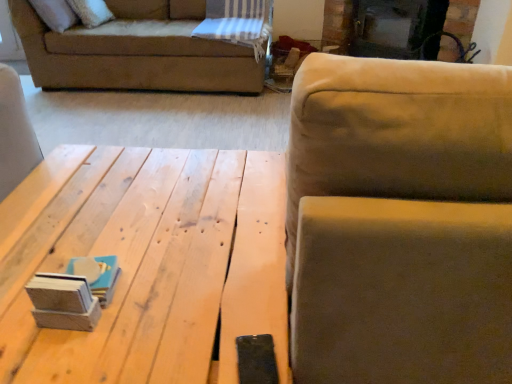
Question: Considering the relative sizes of suede-like beige couch at upper right and natural wood table at center in the image provided, is suede-like beige couch at upper right shorter than natural wood table at center?

Choices:
 (A) yes
 (B) no

Answer: (B)

Question: Can you confirm if suede-like beige couch at upper right is positioned to the right of natural wood table at center?

Choices:
 (A) yes
 (B) no

Answer: (A)

Question: Is suede-like beige couch at upper right looking in the opposite direction of natural wood table at center?

Choices:
 (A) yes
 (B) no

Answer: (B)

Question: Does suede-like beige couch at upper right have a smaller size compared to natural wood table at center?

Choices:
 (A) yes
 (B) no

Answer: (B)

Question: Considering the relative sizes of suede-like beige couch at upper right and natural wood table at center in the image provided, is suede-like beige couch at upper right wider than natural wood table at center?

Choices:
 (A) no
 (B) yes

Answer: (A)

Question: Is suede-like beige couch at upper right not near natural wood table at center?

Choices:
 (A) no
 (B) yes

Answer: (A)

Question: From the image's perspective, is natural wood table at center located beneath black glass fireplace at upper center?

Choices:
 (A) no
 (B) yes

Answer: (B)

Question: Could you tell me if natural wood table at center is turned towards black glass fireplace at upper center?

Choices:
 (A) yes
 (B) no

Answer: (A)

Question: Would you say natural wood table at center is a long distance from black glass fireplace at upper center?

Choices:
 (A) no
 (B) yes

Answer: (B)

Question: Is natural wood table at center outside black glass fireplace at upper center?

Choices:
 (A) no
 (B) yes

Answer: (B)

Question: Does natural wood table at center appear on the right side of black glass fireplace at upper center?

Choices:
 (A) no
 (B) yes

Answer: (A)

Question: Considering the relative sizes of natural wood table at center and black glass fireplace at upper center in the image provided, is natural wood table at center smaller than black glass fireplace at upper center?

Choices:
 (A) no
 (B) yes

Answer: (A)

Question: From the image's perspective, does black glass fireplace at upper center appear higher than suede-like beige couch at upper right?

Choices:
 (A) no
 (B) yes

Answer: (B)